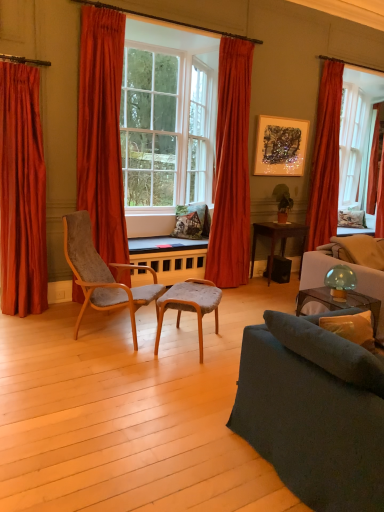
Where is `free space in front of velvet grey chair at center, marked as the 1th chair in a right-to-left arrangement`? The width and height of the screenshot is (384, 512). free space in front of velvet grey chair at center, marked as the 1th chair in a right-to-left arrangement is located at coordinates (179, 375).